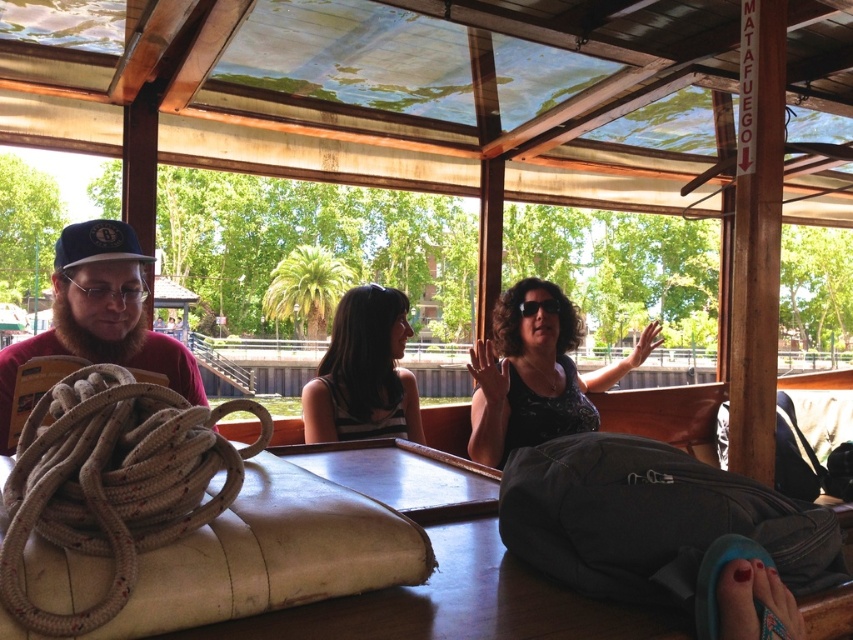
You are a tour guide leading a group in a boat. You need to hand out a brochure to both the matte black shirt at center and the blue fabric baseball cap at left. If your arm can reach 5 feet, can you reach both from your current position?

The distance between the matte black shirt at center and the blue fabric baseball cap at left is 4.85 feet. Since your arm can reach 5 feet, you can reach both individuals as the distance is within your reach.

Based on the coordinates provided, where is the matte red cap at left located in the image?

The matte red cap at left is located at the coordinates point (99, 316).

You are a photographer trying to capture a closeup of both the matte red cap at left and the blue fabric baseball cap at left. Since both are on the left side of the image, which one should you zoom in on first to ensure both are in frame?

The matte red cap at left is larger in size than the blue fabric baseball cap at left, so you should zoom in on the matte red cap at left first to ensure both are in frame.